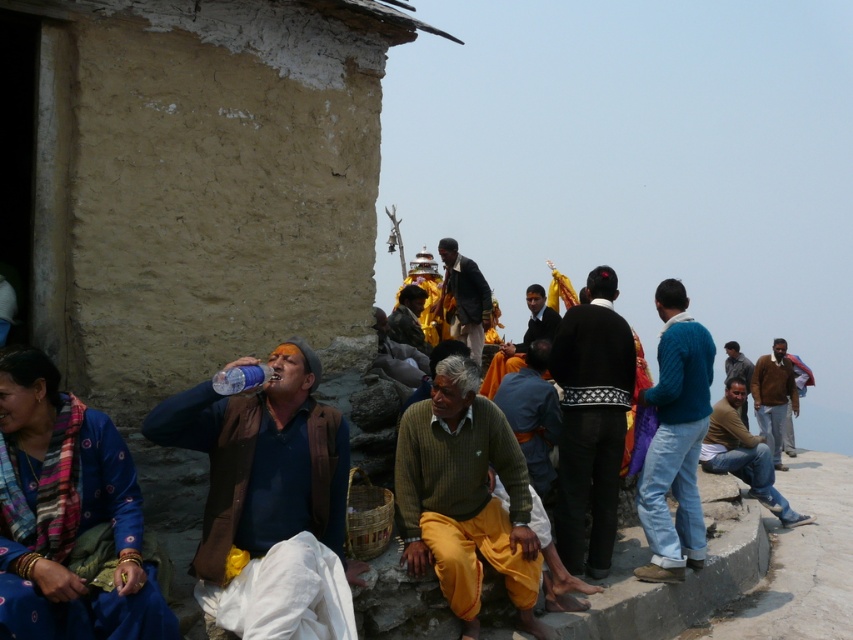
Based on the photo, you are a fashion designer observing the group of people near the rustic structure. You notice the brown woolen sweater at right and the brown textured shirt at center. Which clothing item is positioned higher up in the image?

The brown woolen sweater at right is taller than the brown textured shirt at center, so it is positioned higher up in the image.

From the picture: You are a tailor standing in the scene and need to retrieve both the knitted green sweater at center and the black wool sweater at center. If your arms can reach up to 6 feet, can you grab both sweaters without moving from your current position?

The distance between the knitted green sweater at center and the black wool sweater at center is 7.38 feet, which is longer than your reach of 6 feet. Therefore, you cannot grab both sweaters without moving.